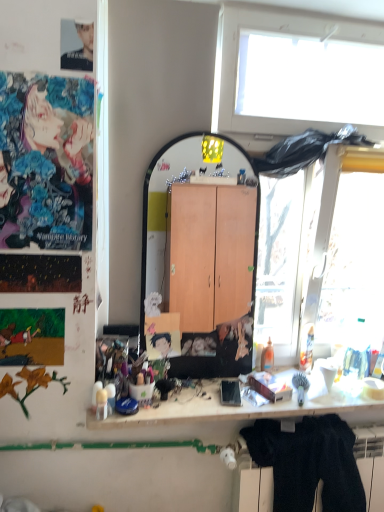
Question: In terms of size, does matte black photo at upper left, which appears as the second person when viewed from the back, appear bigger or smaller than white matte desk at center?

Choices:
 (A) big
 (B) small

Answer: (B)

Question: From a real-world perspective, is matte black photo at upper left, which appears as the second person when viewed from the back, above or below white matte desk at center?

Choices:
 (A) below
 (B) above

Answer: (B)

Question: Estimate the real-world distances between objects in this image. Which object is farther from the matte black photo at upper left, the 2th person when ordered from right to left?

Choices:
 (A) white matte desk at center
 (B) vivid anime poster at upper left, marked as the third person in a right-to-left arrangement
 (C) black fuzzy sweater at lower right
 (D) smooth black hair at center, positioned as the third person in left-to-right order

Answer: (C)

Question: Which object is positioned farthest from the white matte desk at center?

Choices:
 (A) vivid anime poster at upper left, marked as the third person in a right-to-left arrangement
 (B) smooth black hair at center, acting as the third person starting from the front
 (C) matte black photo at upper left, which is the 3th person in bottom-to-top order
 (D) black fuzzy sweater at lower right

Answer: (C)